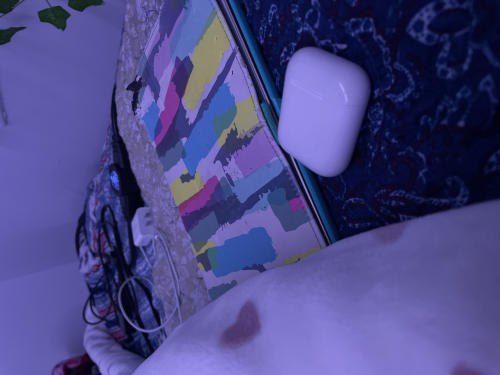
I want to click on black power lead, so click(x=115, y=259).